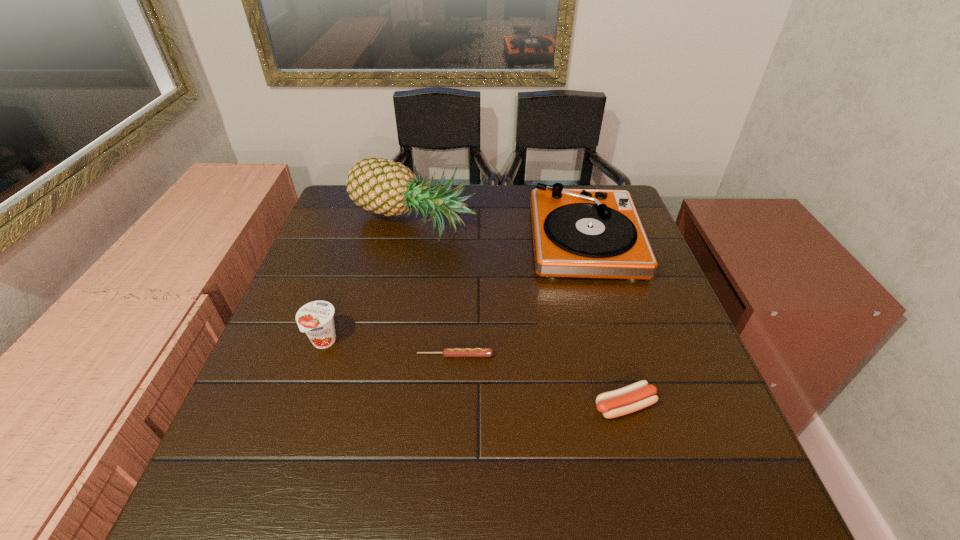
This screenshot has width=960, height=540. In the image, there is a desktop. In order to click on vacant space at the far edge in this screenshot , I will do `click(517, 190)`.

Locate an element on the screen. This screenshot has height=540, width=960. vacant space at the near edge of the desktop is located at coordinates (419, 518).

Locate an element on the screen. The image size is (960, 540). vacant space at the left edge is located at coordinates (321, 258).

Locate an element on the screen. The height and width of the screenshot is (540, 960). free region at the right edge of the desktop is located at coordinates point(637,414).

At what (x,y) coordinates should I click in order to perform the action: click on vacant area that lies between the yogurt and the tallest object. Please return your answer as a coordinate pair (x, y). This screenshot has width=960, height=540. Looking at the image, I should click on (368, 283).

Find the location of a particular element. unoccupied position between the shorter sausage and the pineapple is located at coordinates (434, 289).

Where is `vacant area that lies between the record player and the tallest object`? vacant area that lies between the record player and the tallest object is located at coordinates (498, 232).

At what (x,y) coordinates should I click in order to perform the action: click on blank region between the third tallest object and the record player. Please return your answer as a coordinate pair (x, y). The image size is (960, 540). Looking at the image, I should click on (454, 291).

Locate an element on the screen. This screenshot has height=540, width=960. empty space that is in between the nearer sausage and the yogurt is located at coordinates (474, 374).

At what (x,y) coordinates should I click in order to perform the action: click on empty space between the nearest object and the yogurt. Please return your answer as a coordinate pair (x, y). Looking at the image, I should click on (474, 374).